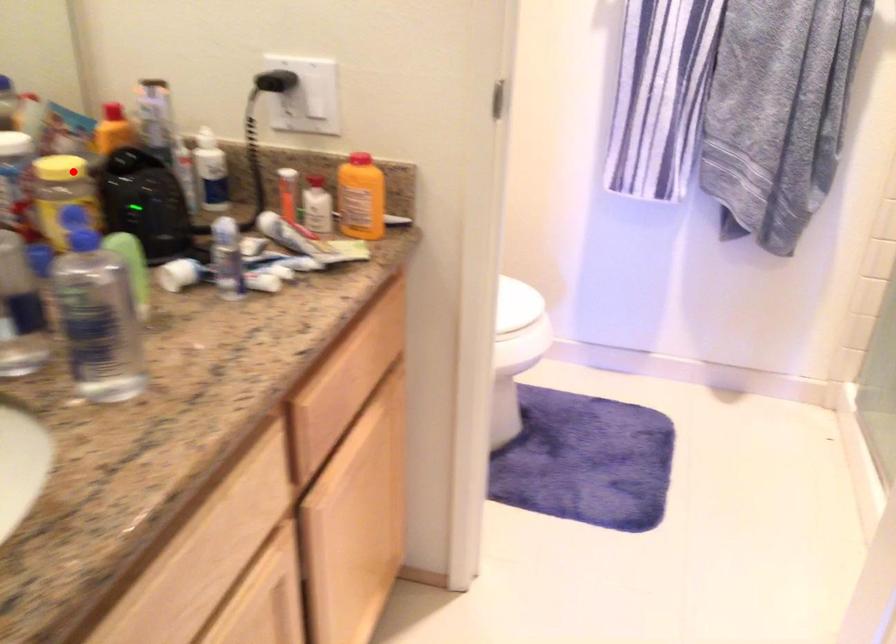
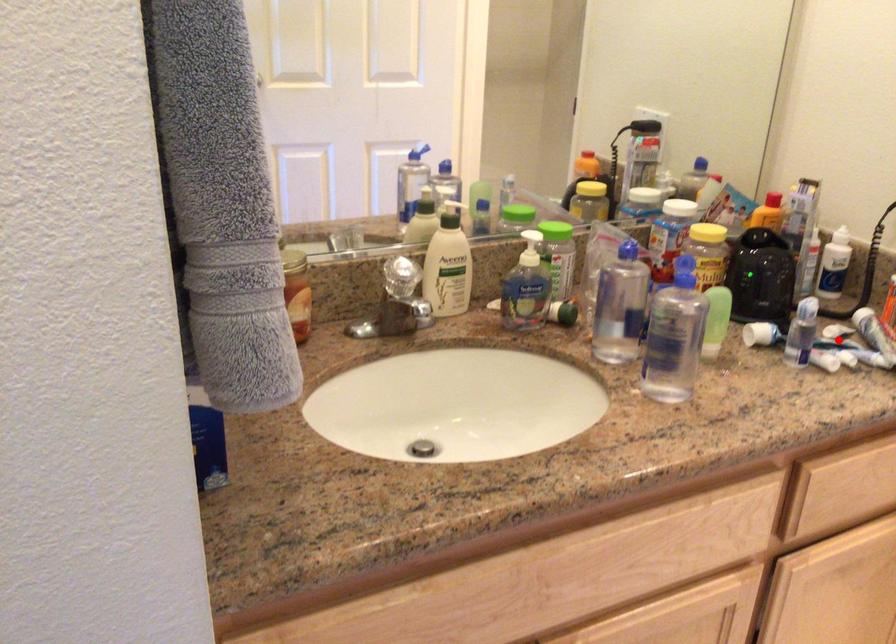
I am providing you with two images of the same scene from different viewpoints. A red point is marked on the first image and another point is marked on the second image. Is the red point in image1 aligned with the point shown in image2?

No